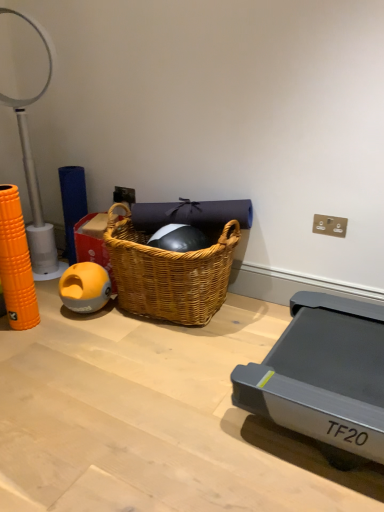
At what (x,y) coordinates should I click in order to perform the action: click on free space in front of woven wood picnic basket at center. Please return your answer as a coordinate pair (x, y). The image size is (384, 512). Looking at the image, I should click on (155, 362).